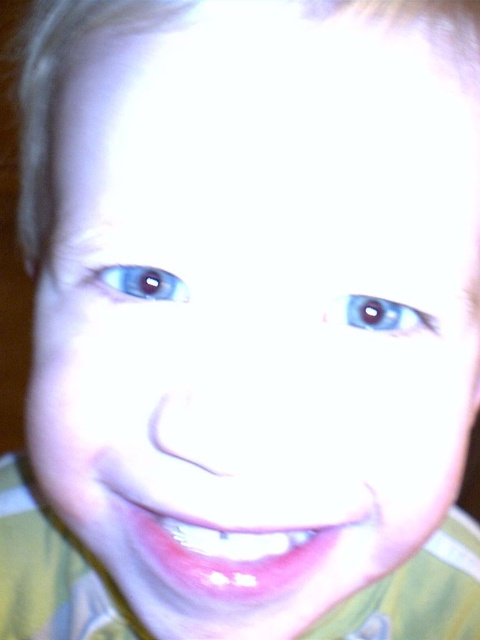
You are a photographer trying to adjust the focus of your camera to capture the pink glossy teeth at center in a close up shot of a child. Where should you position the focus point to ensure the teeth are in sharp focus?

The pink glossy teeth at center are located at point (232,550), so you should position the focus point at those coordinates to ensure the teeth are in sharp focus.

You are a photographer trying to adjust the lighting to reduce glare on the pink glossy teeth at center and the blue glossy eye at center. Which object requires a larger adjustment in size to avoid glare? Please explain your reasoning based on their sizes.

The pink glossy teeth at center requires a larger adjustment because it has a larger size compared to the blue glossy eye at center, making it more prone to glare in bright lighting. To reduce glare effectively, the photographer needs to adjust the lighting more significantly for the larger object.

You are a photographer trying to adjust the lighting for a photo shoot. You notice the pink glossy teeth at center and the blue glossy eye at upper left are both reflecting light. Which object should you adjust the lighting to reduce glare on first, considering their size?

The pink glossy teeth at center should be addressed first because it is larger in size than the blue glossy eye at upper left, making its glare more prominent and impactful on the overall image.